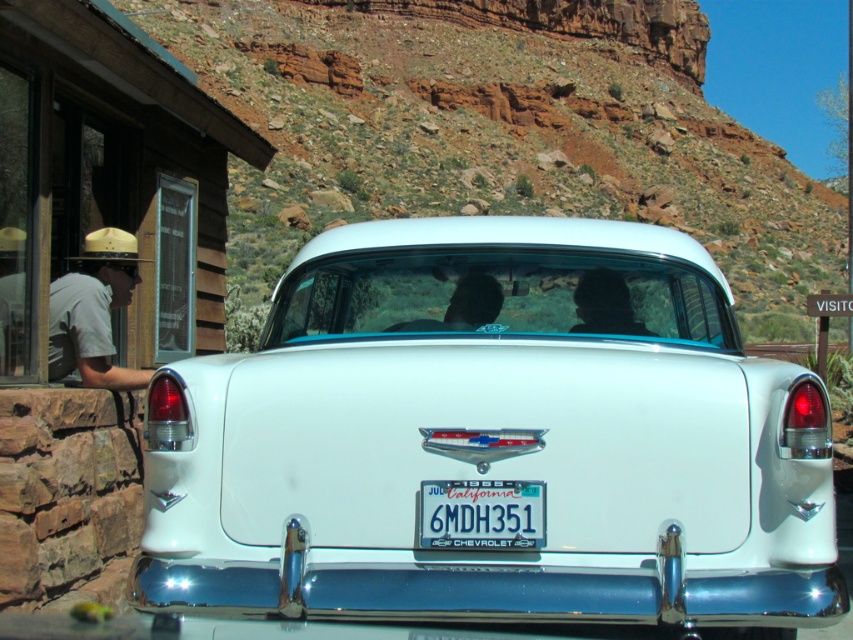
You are standing at the front of the vintage white Chevrolet car parked in front of the rustic wooden building. You want to move towards the back of the car to retrieve a map from the trunk. Which point, point (125, 388) or point (480, 540), is closer to the trunk where the map is located?

Point (125, 388) is behind point (480, 540), so it is closer to the trunk of the vintage white Chevrolet car. Therefore, point (125, 388) is closer to the trunk where the map is located.